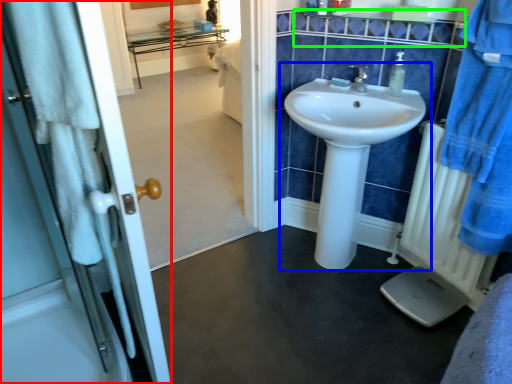
Question: Estimate the real-world distances between objects in this image. Which object is farther from door (highlighted by a red box), sink (highlighted by a blue box) or balustrade (highlighted by a green box)?

Choices:
 (A) sink
 (B) balustrade

Answer: (B)